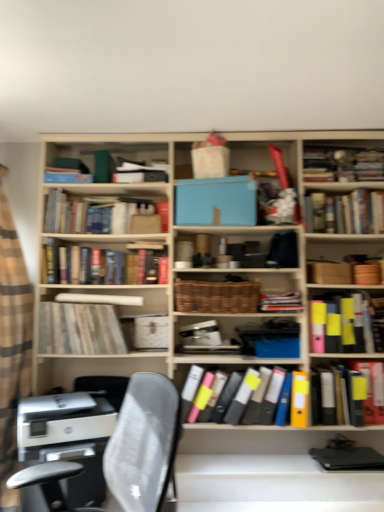
Question: Considering the relative sizes of multicolored file folders at center, the eighth book in the top-to-bottom sequence, and woven brown basket at center in the image provided, is multicolored file folders at center, the eighth book in the top-to-bottom sequence, smaller than woven brown basket at center?

Choices:
 (A) no
 (B) yes

Answer: (A)

Question: Would you say woven brown basket at center is part of multicolored file folders at center, positioned as the first book in bottom-to-top order,'s contents?

Choices:
 (A) yes
 (B) no

Answer: (B)

Question: Is multicolored file folders at center, the eighth book in the top-to-bottom sequence, far away from woven brown basket at center?

Choices:
 (A) yes
 (B) no

Answer: (B)

Question: Is multicolored file folders at center, positioned as the first book in bottom-to-top order, oriented away from woven brown basket at center?

Choices:
 (A) no
 (B) yes

Answer: (A)

Question: Considering the relative sizes of multicolored file folders at center, positioned as the first book in bottom-to-top order, and woven brown basket at center in the image provided, is multicolored file folders at center, positioned as the first book in bottom-to-top order, wider than woven brown basket at center?

Choices:
 (A) yes
 (B) no

Answer: (A)

Question: Is multicolored file folders at center, the eighth book in the top-to-bottom sequence, directly adjacent to woven brown basket at center?

Choices:
 (A) no
 (B) yes

Answer: (A)

Question: Can you confirm if hardcover books at center, which is the 3th book from top to bottom, is thinner than matte yellow folder at right, positioned as the fourth book in bottom-to-top order?

Choices:
 (A) yes
 (B) no

Answer: (A)

Question: Is hardcover books at center, which is the 3th book from top to bottom, with matte yellow folder at right, the fifth book in the top-to-bottom sequence?

Choices:
 (A) yes
 (B) no

Answer: (B)

Question: From the image's perspective, is hardcover books at center, which is the 3th book from top to bottom, below matte yellow folder at right, positioned as the fourth book in bottom-to-top order?

Choices:
 (A) no
 (B) yes

Answer: (A)

Question: Does hardcover books at center, which is the 3th book from top to bottom, contain matte yellow folder at right, positioned as the fourth book in bottom-to-top order?

Choices:
 (A) yes
 (B) no

Answer: (B)

Question: Considering the relative sizes of hardcover books at center, which is the 3th book from top to bottom, and matte yellow folder at right, positioned as the fourth book in bottom-to-top order, in the image provided, is hardcover books at center, which is the 3th book from top to bottom, smaller than matte yellow folder at right, positioned as the fourth book in bottom-to-top order,?

Choices:
 (A) no
 (B) yes

Answer: (A)

Question: Can you confirm if hardcover books at center, marked as the 6th book in a bottom-to-top arrangement, is taller than matte yellow folder at right, positioned as the fourth book in bottom-to-top order?

Choices:
 (A) no
 (B) yes

Answer: (A)

Question: Is hardcover books at upper left, the eighth book in the bottom-to-top sequence, surrounding woven brown basket at center?

Choices:
 (A) no
 (B) yes

Answer: (A)